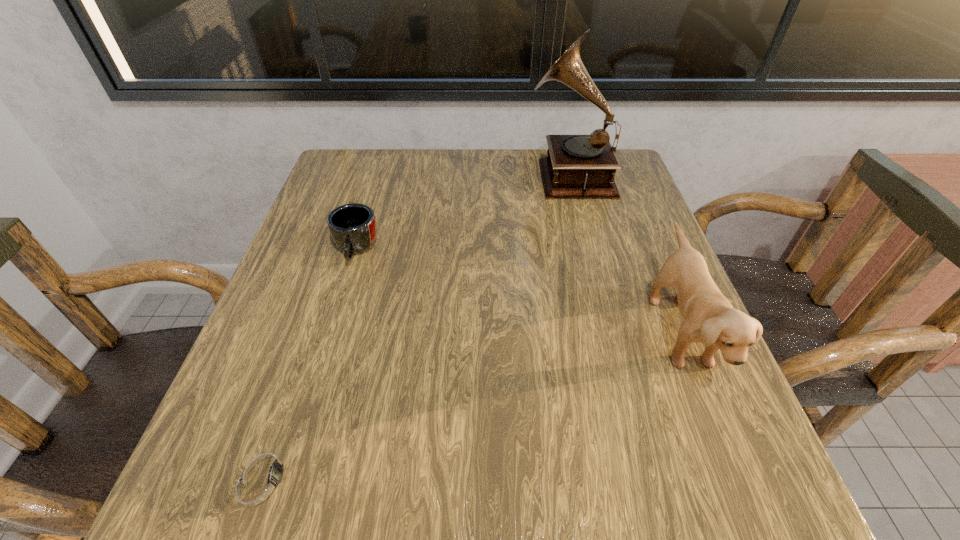
Identify the location of the farthest object. This screenshot has height=540, width=960. (577, 166).

Image resolution: width=960 pixels, height=540 pixels. Identify the location of the tallest object. (577, 166).

Find the location of a particular element. This screenshot has width=960, height=540. puppy is located at coordinates (709, 318).

You are a GUI agent. You are given a task and a screenshot of the screen. Output one action in this format:
    pyautogui.click(x=<x>, y=<y>)
    Task: Click on the mug
    This screenshot has width=960, height=540.
    Given the screenshot: What is the action you would take?
    pyautogui.click(x=352, y=226)

At what (x,y) coordinates should I click in order to perform the action: click on watch. Please return your answer as a coordinate pair (x, y). The height and width of the screenshot is (540, 960). Looking at the image, I should click on (261, 480).

This screenshot has width=960, height=540. I want to click on the nearest object, so click(261, 480).

Where is `blank space located 0.220m on the horn of the record player`? blank space located 0.220m on the horn of the record player is located at coordinates (440, 175).

This screenshot has height=540, width=960. I want to click on vacant area situated on the horn of the record player, so (484, 175).

Find the location of `vacant space located 0.390m on the horn of the record player`. vacant space located 0.390m on the horn of the record player is located at coordinates (371, 175).

At what (x,y) coordinates should I click in order to perform the action: click on vacant region located on the left side of the puppy. Please return your answer as a coordinate pair (x, y). Looking at the image, I should click on click(x=473, y=331).